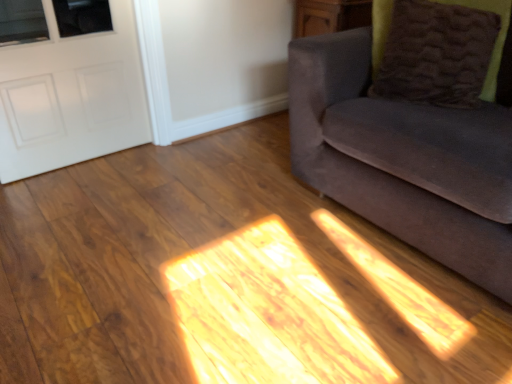
Question: From the image's perspective, is white matte door at left located above or below brown fuzzy pillow at upper right?

Choices:
 (A) below
 (B) above

Answer: (A)

Question: From a real-world perspective, is white matte door at left physically located above or below brown fuzzy pillow at upper right?

Choices:
 (A) above
 (B) below

Answer: (B)

Question: Considering the real-world distances, which object is farthest from the brown fuzzy pillow at upper right?

Choices:
 (A) white matte door at left
 (B) velvet gray couch at right

Answer: (A)

Question: Estimate the real-world distances between objects in this image. Which object is farther from the velvet gray couch at right?

Choices:
 (A) brown fuzzy pillow at upper right
 (B) white matte door at left

Answer: (B)